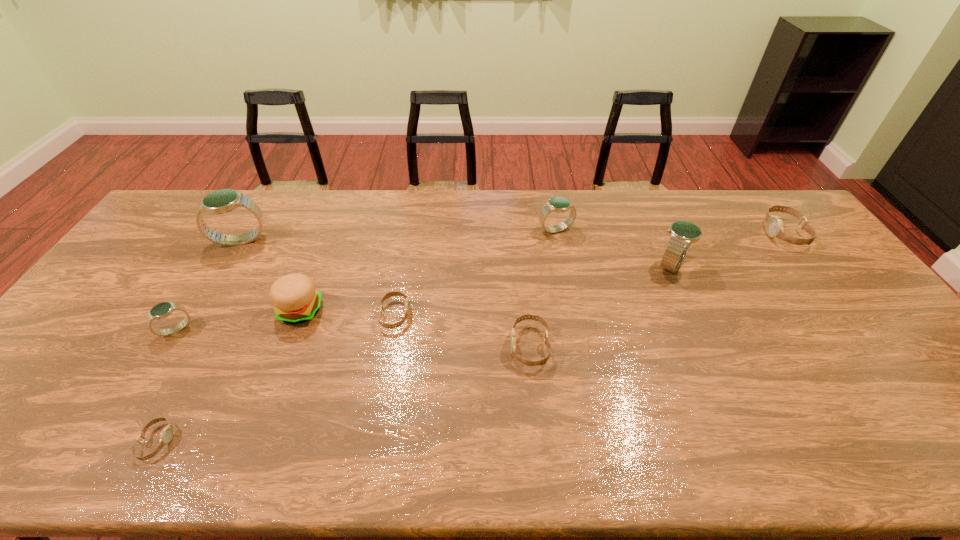
Locate an element on the screen. This screenshot has width=960, height=540. free area in between the leftmost beige watch and the biggest beige watch is located at coordinates [470, 338].

You are a GUI agent. You are given a task and a screenshot of the screen. Output one action in this format:
    pyautogui.click(x=<x>, y=<y>)
    Task: Click on the unoccupied area between the rightmost object and the tallest object
    Image resolution: width=960 pixels, height=540 pixels.
    Given the screenshot: What is the action you would take?
    pyautogui.click(x=513, y=237)

At what (x,y) coordinates should I click in order to perform the action: click on unoccupied area between the fifth object from left to right and the second blue watch from right to left. Please return your answer as a coordinate pair (x, y). The width and height of the screenshot is (960, 540). Looking at the image, I should click on (475, 272).

What are the coordinates of `empty space that is in between the rightmost watch and the nearest blue watch` in the screenshot? It's located at (480, 281).

What are the coordinates of `vacant area that lies between the smallest blue watch and the tallest object` in the screenshot? It's located at point(208,285).

The height and width of the screenshot is (540, 960). Find the location of `empty location between the nearest watch and the fourth object from left to right`. empty location between the nearest watch and the fourth object from left to right is located at coordinates (228, 376).

You are a GUI agent. You are given a task and a screenshot of the screen. Output one action in this format:
    pyautogui.click(x=<x>, y=<y>)
    Task: Click on the free space that is in between the fourth object from left to right and the smallest blue watch
    The height and width of the screenshot is (540, 960).
    Given the screenshot: What is the action you would take?
    pyautogui.click(x=238, y=320)

The height and width of the screenshot is (540, 960). In order to click on object that is the fifth closest to the hamburger in this screenshot , I will do `click(541, 362)`.

You are a GUI agent. You are given a task and a screenshot of the screen. Output one action in this format:
    pyautogui.click(x=<x>, y=<y>)
    Task: Click on the object that can be found as the eighth closest to the second blue watch from right to left
    Image resolution: width=960 pixels, height=540 pixels.
    Given the screenshot: What is the action you would take?
    pyautogui.click(x=166, y=435)

Identify the location of watch that is the fourth closest to the second smallest blue watch. (774, 225).